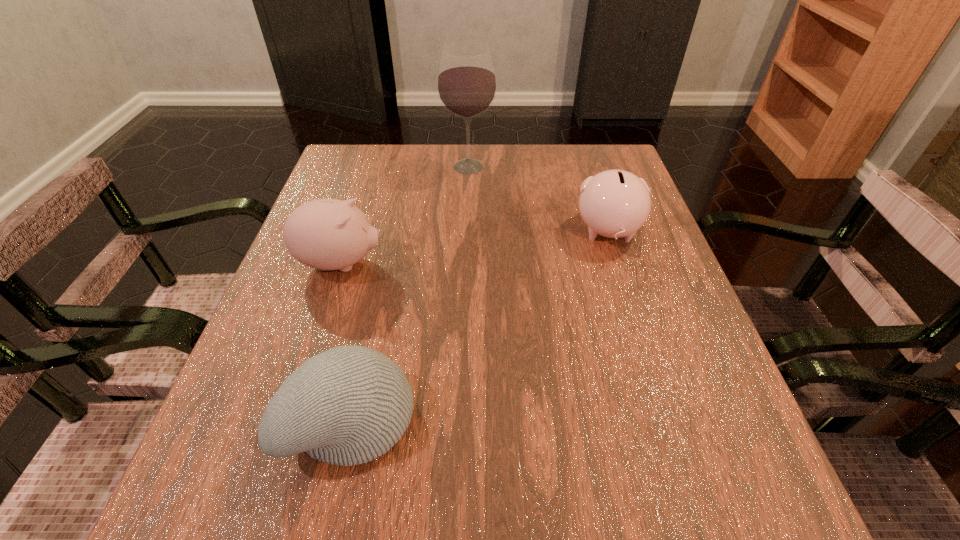
Identify the location of object that is positioned at the near edge. The height and width of the screenshot is (540, 960). [x=348, y=405].

This screenshot has height=540, width=960. I want to click on piggy bank present at the left edge, so click(x=327, y=234).

The width and height of the screenshot is (960, 540). I want to click on beanie located in the left edge section of the desktop, so click(x=348, y=405).

At what (x,y) coordinates should I click in order to perform the action: click on object positioned at the right edge. Please return your answer as a coordinate pair (x, y). The image size is (960, 540). Looking at the image, I should click on (615, 203).

Identify the location of object situated at the near left corner. (348, 405).

The width and height of the screenshot is (960, 540). I want to click on vacant space at the far edge of the desktop, so click(x=464, y=190).

The width and height of the screenshot is (960, 540). In the image, there is a desktop. In order to click on free space at the near edge in this screenshot , I will do `click(556, 502)`.

This screenshot has height=540, width=960. Find the location of `vacant point at the left edge`. vacant point at the left edge is located at coordinates (264, 397).

I want to click on free space at the right edge of the desktop, so click(x=642, y=227).

This screenshot has width=960, height=540. Identify the location of free space at the far left corner of the desktop. (353, 192).